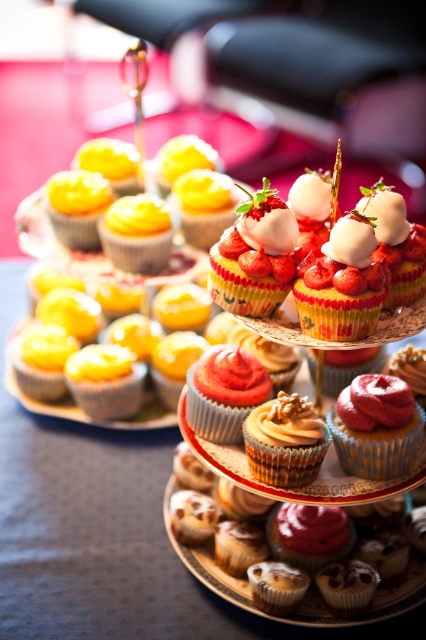
Can you confirm if smooth red frosting cupcake at center is positioned to the right of yellow matte cupcake at upper left?

Indeed, smooth red frosting cupcake at center is positioned on the right side of yellow matte cupcake at upper left.

Who is higher up, smooth red frosting cupcake at center or yellow matte cupcake at upper left?

Positioned higher is smooth red frosting cupcake at center.

Locate an element on the screen. This screenshot has width=426, height=640. smooth red frosting cupcake at center is located at coordinates (224, 392).

Between smooth pink frosting cupcake at center and caramelized walnut cupcake at center, which one appears on the left side from the viewer's perspective?

caramelized walnut cupcake at center

Does smooth pink frosting cupcake at center have a greater width compared to caramelized walnut cupcake at center?

Correct, the width of smooth pink frosting cupcake at center exceeds that of caramelized walnut cupcake at center.

Image resolution: width=426 pixels, height=640 pixels. In order to click on smooth pink frosting cupcake at center in this screenshot , I will do click(x=376, y=426).

Between smooth pink frosting cupcake at center and glazed brown muffin at center, which one has more height?

With more height is smooth pink frosting cupcake at center.

Is point (367, 419) more distant than point (281, 573)?

No, (367, 419) is in front of (281, 573).

Image resolution: width=426 pixels, height=640 pixels. I want to click on smooth pink frosting cupcake at center, so click(x=376, y=426).